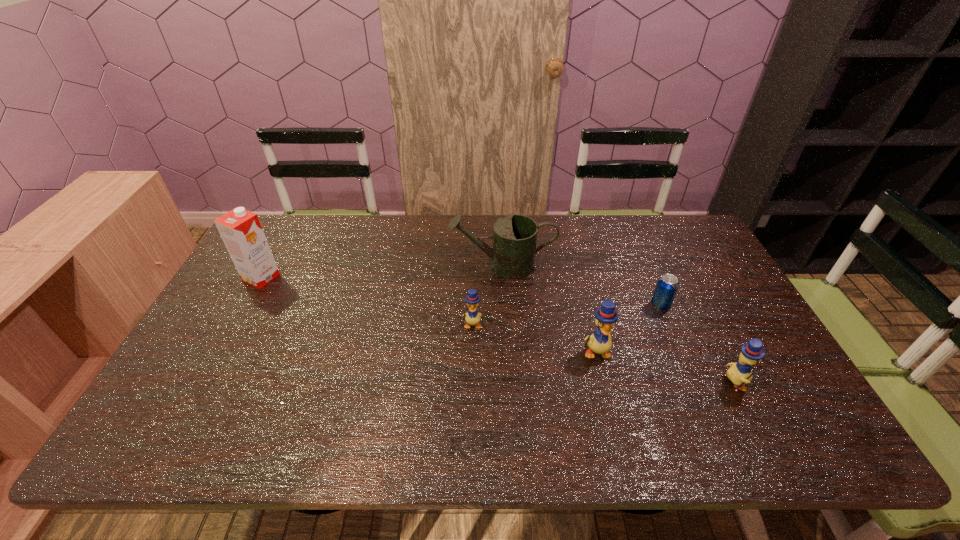
Where is `the third nearest object`? This screenshot has width=960, height=540. the third nearest object is located at coordinates click(x=472, y=299).

Identify the location of the fifth tallest object. (472, 299).

This screenshot has width=960, height=540. Identify the location of the second nearest object. pyautogui.click(x=599, y=342).

This screenshot has width=960, height=540. I want to click on the third object from right to left, so click(x=599, y=342).

I want to click on the nearest object, so click(752, 352).

Where is `the rightmost object`? This screenshot has width=960, height=540. the rightmost object is located at coordinates [x=752, y=352].

At what (x,y) coordinates should I click in order to perform the action: click on beer can. Please return your answer as a coordinate pair (x, y). This screenshot has height=540, width=960. Looking at the image, I should click on (667, 285).

Identify the location of the third farthest object. (667, 285).

Identify the location of the tallest object. The width and height of the screenshot is (960, 540). (241, 231).

This screenshot has height=540, width=960. Find the location of `carton`. carton is located at coordinates (241, 231).